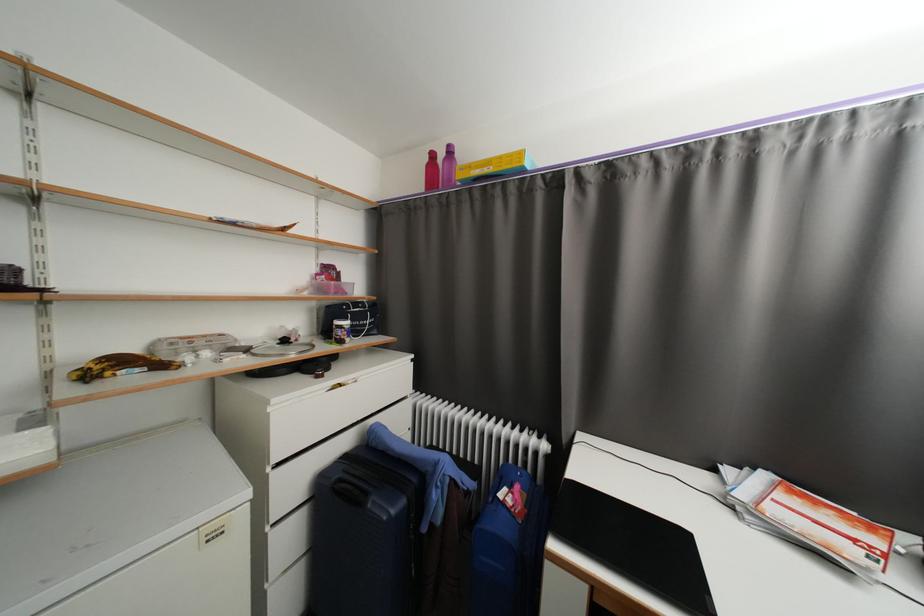
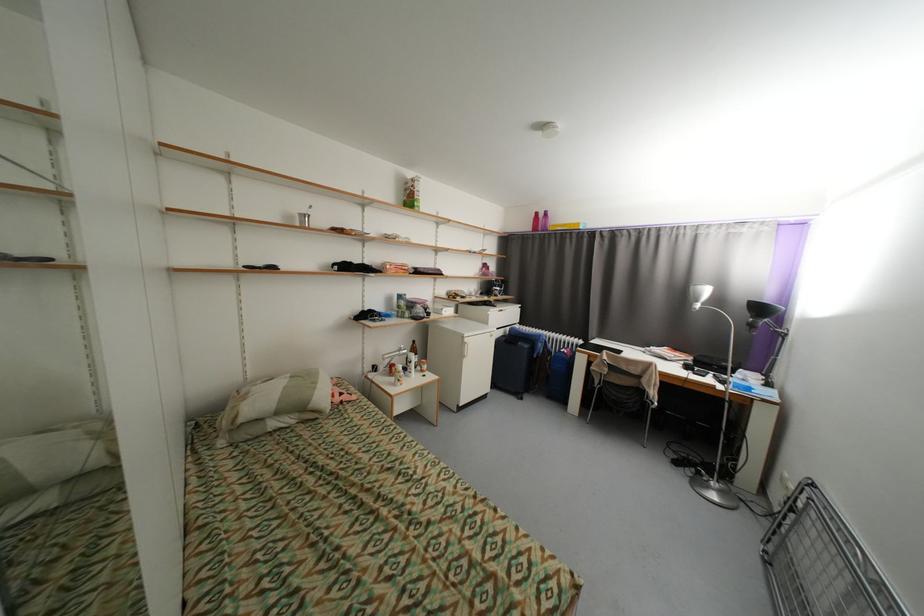
In the second image, find the point that corresponds to pixel 439 156 in the first image.

(542, 215)